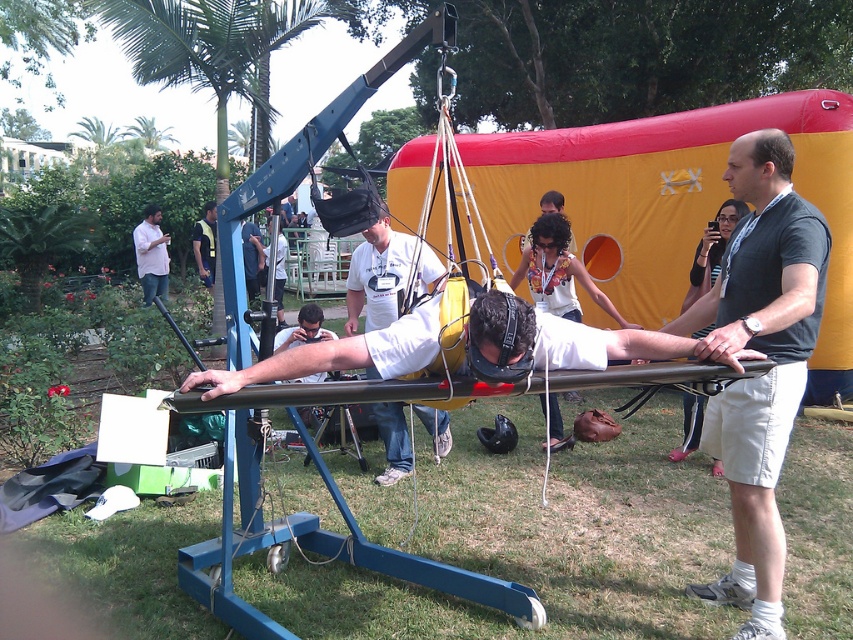
Is point (767, 257) positioned behind point (534, 273)?

No, (767, 257) is closer to viewer.

Between dark gray t-shirt at center and white matte/soft fabric at center, which one is positioned lower?

dark gray t-shirt at center is below.

Does point (721, 321) come closer to viewer compared to point (552, 406)?

Yes.

In order to click on dark gray t-shirt at center in this screenshot , I will do `click(764, 353)`.

Can you confirm if white matte shirt at center is positioned to the right of black matte shirt at upper right?

No, white matte shirt at center is not to the right of black matte shirt at upper right.

Based on the photo, who is more distant from viewer, (361,260) or (720,209)?

Positioned behind is point (720,209).

Is point (450, 435) less distant than point (700, 241)?

Yes.

Where is `white matte shirt at center`? Image resolution: width=853 pixels, height=640 pixels. white matte shirt at center is located at coordinates (386, 275).

Is white matte/soft fabric at center positioned behind white shirt at upper left?

No, it is in front of white shirt at upper left.

Who is more forward, (x=585, y=269) or (x=152, y=278)?

Point (x=585, y=269)

You are a GUI agent. You are given a task and a screenshot of the screen. Output one action in this format:
    pyautogui.click(x=<x>, y=<y>)
    Task: Click on the white matte/soft fabric at center
    This screenshot has width=853, height=640.
    Given the screenshot: What is the action you would take?
    pyautogui.click(x=558, y=272)